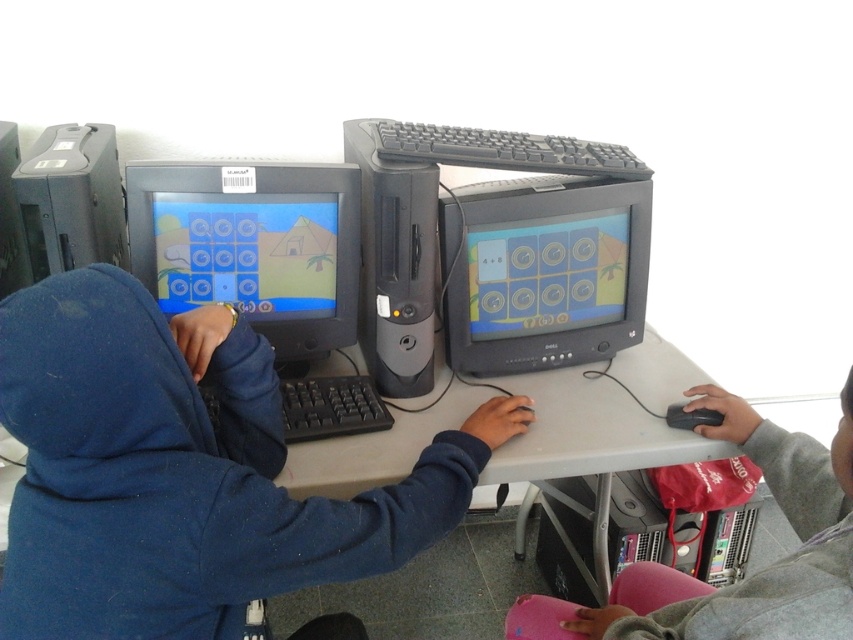
Question: Which of the following is the closest to the observer?

Choices:
 (A) blue fleece hoodie at left
 (B) black plastic keyboard at center
 (C) matte black monitor at center
 (D) black plastic mouse at lower right

Answer: (A)

Question: Which point is farther to the camera?

Choices:
 (A) matte black monitor at left
 (B) black plastic mouse at lower right
 (C) black plastic computer tower at lower center
 (D) matte black monitor at center

Answer: (C)

Question: Which point is closer to the camera taking this photo?

Choices:
 (A) (202, 246)
 (B) (851, 595)

Answer: (B)

Question: Can you confirm if black plastic computer tower at lower center is wider than black plastic mouse at lower right?

Choices:
 (A) no
 (B) yes

Answer: (B)

Question: Does blue fleece hoodie at left appear on the left side of black plastic keyboard at center?

Choices:
 (A) yes
 (B) no

Answer: (B)

Question: From the image, what is the correct spatial relationship of black plastic computer tower at lower center in relation to black plastic mouse at lower right?

Choices:
 (A) below
 (B) above

Answer: (A)